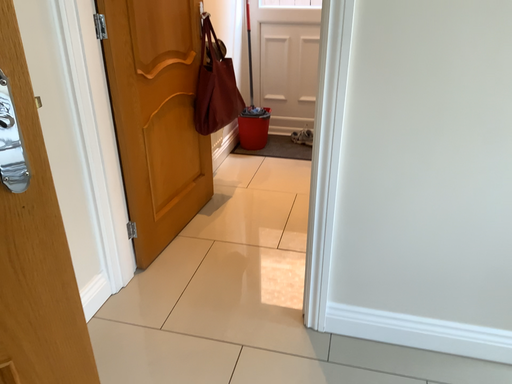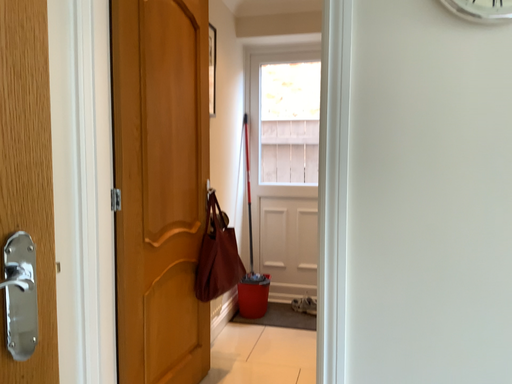
Question: Which way did the camera rotate in the video?

Choices:
 (A) rotated downward
 (B) rotated upward

Answer: (B)